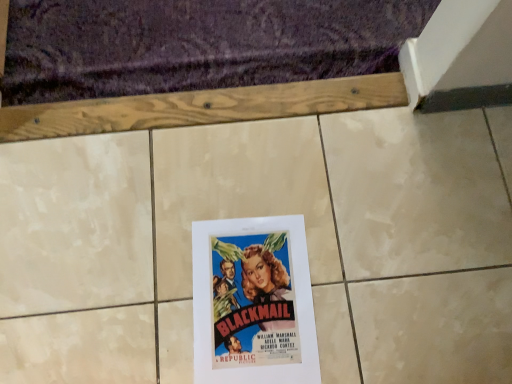
You are a GUI agent. You are given a task and a screenshot of the screen. Output one action in this format:
    pyautogui.click(x=<x>, y=<y>)
    Task: Click on the free spot to the left of matte paper poster at center
    This screenshot has height=384, width=512.
    Given the screenshot: What is the action you would take?
    pyautogui.click(x=131, y=287)